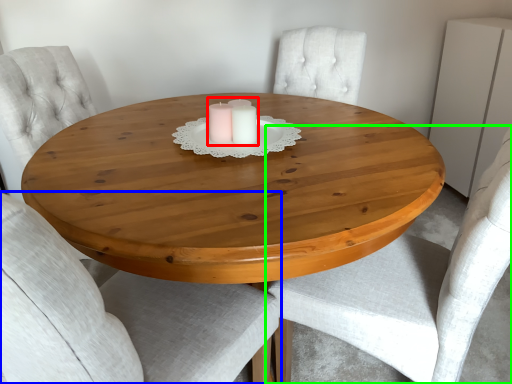
Question: Which object is positioned closest to candle holder (highlighted by a red box)? Select from chair (highlighted by a blue box) and chair (highlighted by a green box).

Choices:
 (A) chair
 (B) chair

Answer: (A)